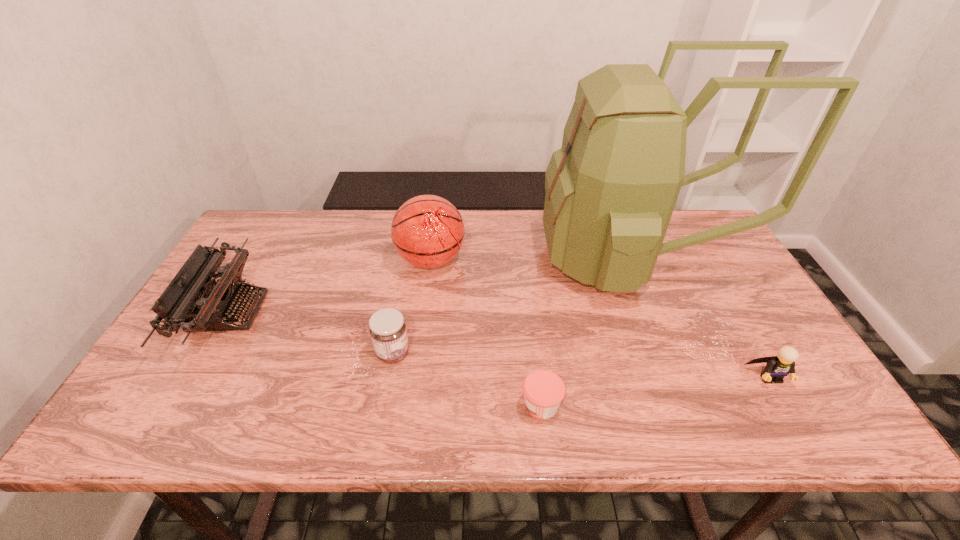
The width and height of the screenshot is (960, 540). Find the location of `backpack`. backpack is located at coordinates (611, 189).

This screenshot has height=540, width=960. Find the location of `the second tallest object`. the second tallest object is located at coordinates (427, 231).

You are a GUI agent. You are given a task and a screenshot of the screen. Output one action in this format:
    pyautogui.click(x=<x>, y=<y>)
    Task: Click on the typewriter
    
    Given the screenshot: What is the action you would take?
    pyautogui.click(x=192, y=301)

Where is `the left jam`? the left jam is located at coordinates (387, 328).

Locate an element on the screen. Image resolution: width=960 pixels, height=540 pixels. the taller jam is located at coordinates 387,328.

Locate an element on the screen. The image size is (960, 540). Lego is located at coordinates (777, 367).

The image size is (960, 540). I want to click on the fourth object from left to right, so click(x=544, y=390).

Image resolution: width=960 pixels, height=540 pixels. Find the location of `the shorter jam`. the shorter jam is located at coordinates (544, 390).

Where is `free space located 0.310m on the front pocket of the tallest object`? The width and height of the screenshot is (960, 540). free space located 0.310m on the front pocket of the tallest object is located at coordinates (440, 258).

Where is `blank space located 0.390m on the front pocket of the tallest object`? The image size is (960, 540). blank space located 0.390m on the front pocket of the tallest object is located at coordinates (413, 258).